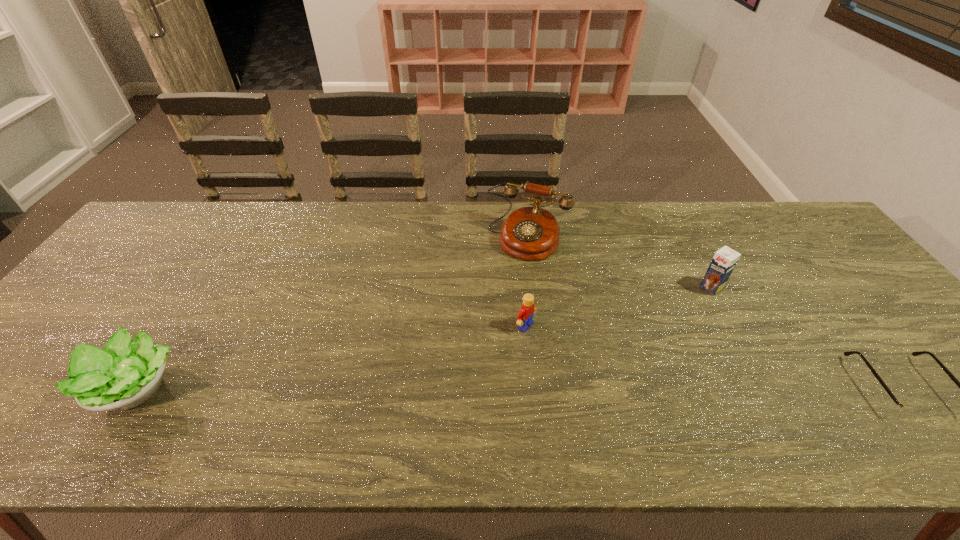
The image size is (960, 540). I want to click on vacant space that is in between the second farthest object and the third farthest object, so click(x=618, y=307).

At what (x,y) coordinates should I click in order to perform the action: click on empty space between the Lego and the leftmost object. Please return your answer as a coordinate pair (x, y). The width and height of the screenshot is (960, 540). Looking at the image, I should click on (329, 356).

The width and height of the screenshot is (960, 540). In order to click on free spot between the leftmost object and the farthest object in this screenshot , I will do pos(331,313).

What are the coordinates of `the closest object to the third nearest object` in the screenshot? It's located at (531, 233).

Identify which object is the third closest to the shortest object. Please provide its 2D coordinates. Your answer should be formatted as a tuple, i.e. [(x, y)], where the tuple contains the x and y coordinates of a point satisfying the conditions above.

[(525, 315)]